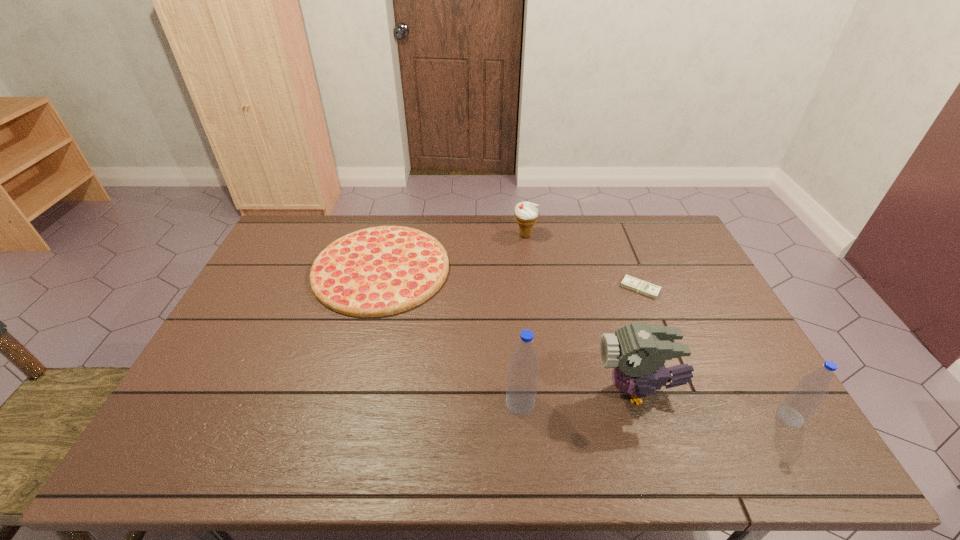
This screenshot has width=960, height=540. I want to click on free space between the bird and the second shortest object, so click(x=510, y=329).

Find the location of `unoccupied position between the second shortest object and the icecream`. unoccupied position between the second shortest object and the icecream is located at coordinates (453, 252).

The width and height of the screenshot is (960, 540). In order to click on free space between the bird and the icecream in this screenshot , I will do `click(582, 313)`.

Find the location of `vacant point located between the leftmost object and the shortest object`. vacant point located between the leftmost object and the shortest object is located at coordinates (511, 279).

This screenshot has height=540, width=960. In order to click on empty location between the third shortest object and the shortest object in this screenshot , I will do `click(583, 262)`.

Where is `vacant area that lies between the icecream and the bird`? This screenshot has width=960, height=540. vacant area that lies between the icecream and the bird is located at coordinates (582, 313).

Image resolution: width=960 pixels, height=540 pixels. Identify the location of free space between the leftmost object and the left water bottle. (451, 336).

Identify the location of object that is the fifth nearest to the left water bottle. The image size is (960, 540). (526, 213).

Identify which object is the nearest to the tallest object. Please provide its 2D coordinates. Your answer should be formatted as a tuple, i.e. [(x, y)], where the tuple contains the x and y coordinates of a point satisfying the conditions above.

[(637, 352)]

This screenshot has height=540, width=960. What are the coordinates of `free space that satisfies the following two spatial constraints: 1. on the back side of the shorter water bottle; 2. at the beak of the bird` in the screenshot? It's located at (775, 390).